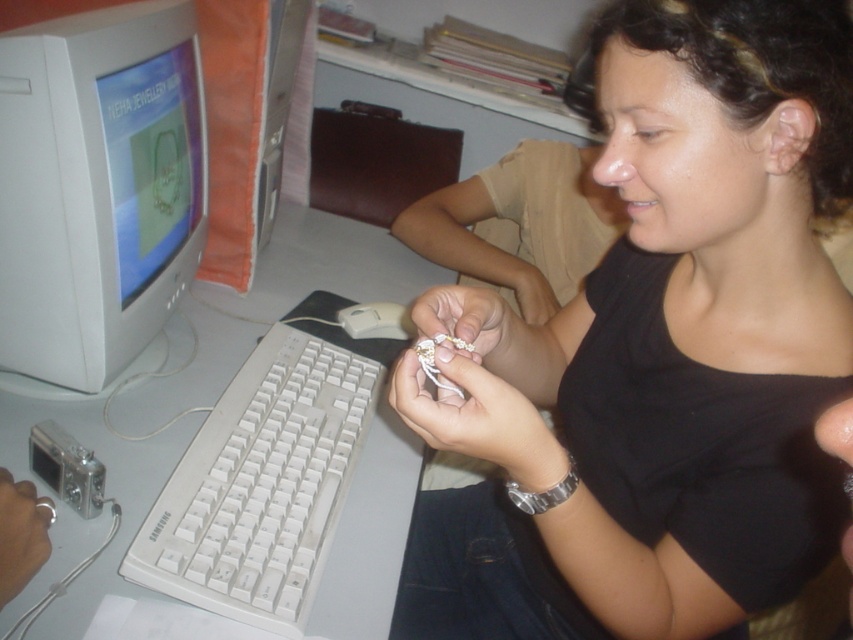
Who is more distant from viewer, (503, 312) or (392, 332)?

The point (392, 332) is more distant.

Can you confirm if gold metallic ring at center is shorter than white plastic mouse at center?

Incorrect, gold metallic ring at center's height does not fall short of white plastic mouse at center's.

This screenshot has height=640, width=853. What do you see at coordinates (454, 328) in the screenshot?
I see `gold metallic ring at center` at bounding box center [454, 328].

Where is `gold metallic ring at center`? The height and width of the screenshot is (640, 853). gold metallic ring at center is located at coordinates point(454,328).

Can you confirm if white plastic monitor at left is wider than white plastic keyboard at lower left?

No.

The width and height of the screenshot is (853, 640). I want to click on white plastic monitor at left, so click(97, 186).

Is matte black shirt at center smaller than gold metallic ring at center?

No.

Which is in front, point (718, 204) or point (502, 314)?

Point (718, 204)

Who is more distant from viewer, [799,141] or [466,291]?

The point [466,291] is more distant.

What are the coordinates of `matte black shirt at center` in the screenshot? It's located at (662, 355).